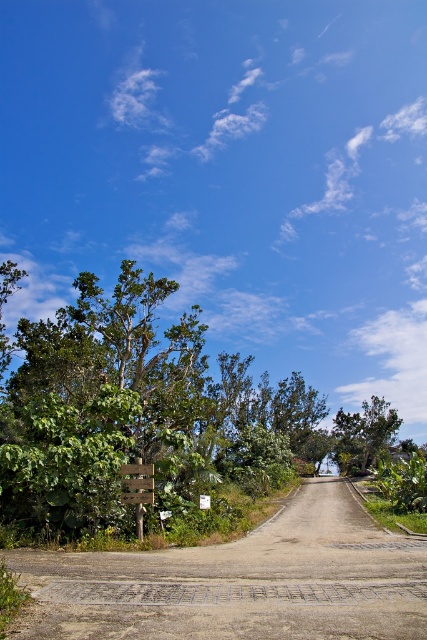
You are standing on the road in the image and want to walk to the green leafy tree at left located at point (151, 416). Which direction should you face to walk directly towards it?

You should face towards the left side of the road to walk directly towards the green leafy tree at left located at point (151, 416).